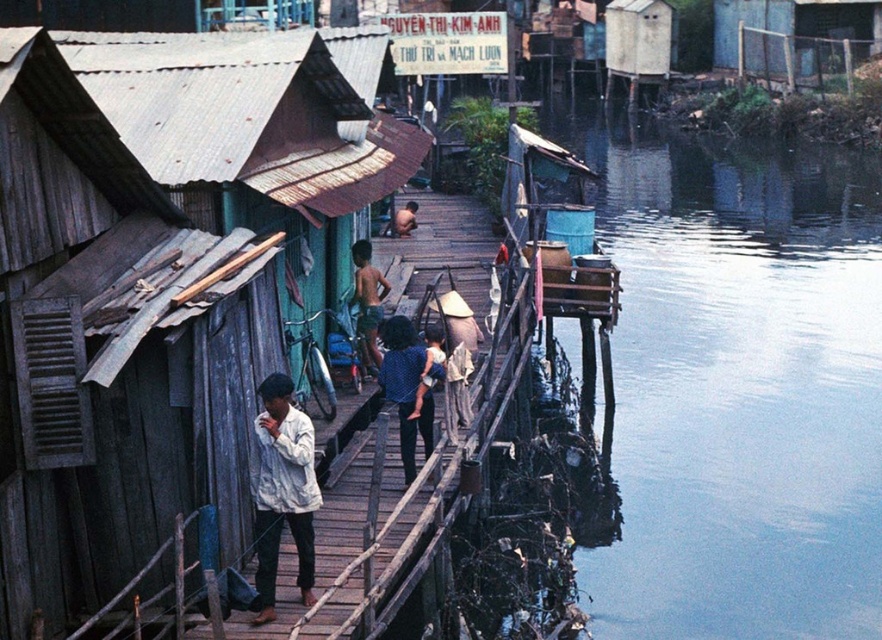
You are a photographer standing on the wooden walkway. You want to capture a photo that includes both the blue water at right and the white cotton shirt at center. Which object should you zoom in on to ensure both are in the frame without moving your position?

You should zoom in on the white cotton shirt at center because the blue water at right is wider than the white cotton shirt at center, so focusing on the narrower object allows both to fit within the frame.